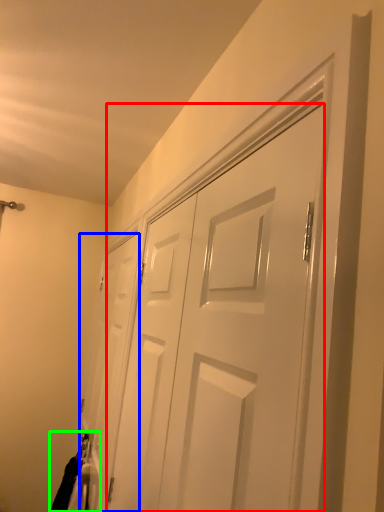
Question: Based on their relative distances, which object is nearer to door (highlighted by a red box)? Choose from door (highlighted by a blue box) and laundry (highlighted by a green box).

Choices:
 (A) door
 (B) laundry

Answer: (A)